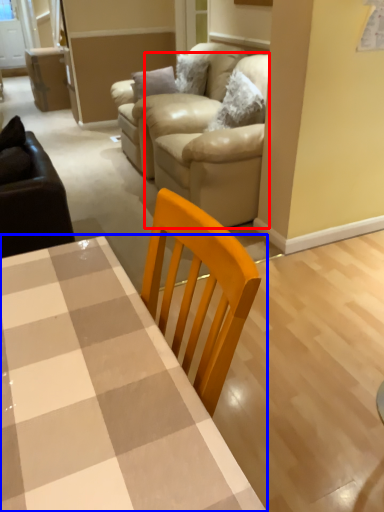
Question: Which of the following is the closest to the observer, couch (highlighted by a red box) or table (highlighted by a blue box)?

Choices:
 (A) couch
 (B) table

Answer: (B)